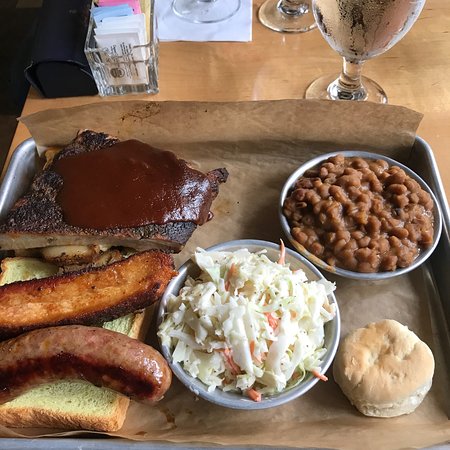
The width and height of the screenshot is (450, 450). Identify the location of table. (220, 82).